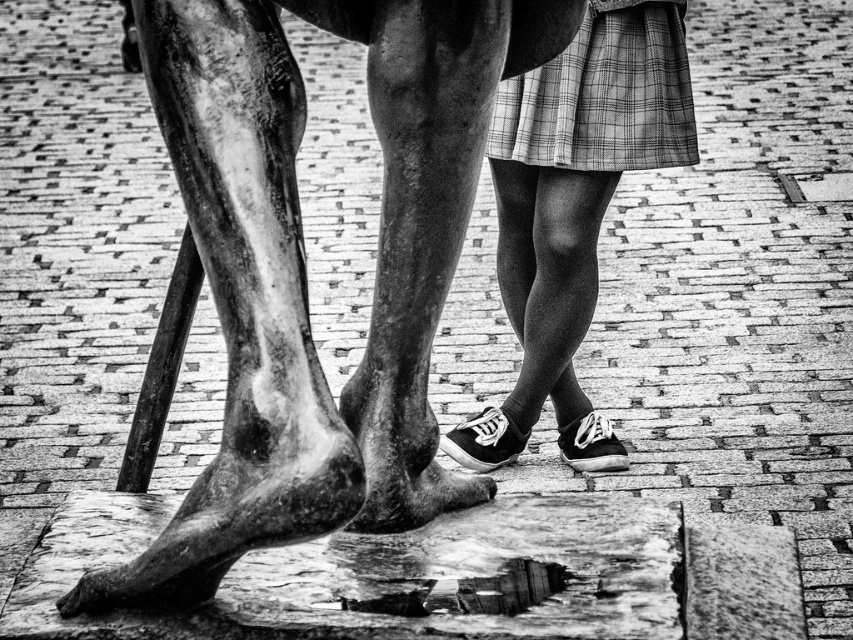
Question: Which object appears closest to the camera in this image?

Choices:
 (A) plaid fabric skirt at center
 (B) bronze statue at center

Answer: (B)

Question: In this image, where is bronze statue at center located relative to plaid fabric skirt at center?

Choices:
 (A) below
 (B) above

Answer: (B)

Question: Which object appears farthest from the camera in this image?

Choices:
 (A) plaid fabric skirt at center
 (B) bronze statue at center

Answer: (A)

Question: Which point is closer to the camera?

Choices:
 (A) (216, 484)
 (B) (532, 232)

Answer: (A)

Question: Considering the relative positions of bronze statue at center and plaid fabric skirt at center in the image provided, where is bronze statue at center located with respect to plaid fabric skirt at center?

Choices:
 (A) left
 (B) right

Answer: (A)

Question: Can you confirm if bronze statue at center is bigger than plaid fabric skirt at center?

Choices:
 (A) yes
 (B) no

Answer: (A)